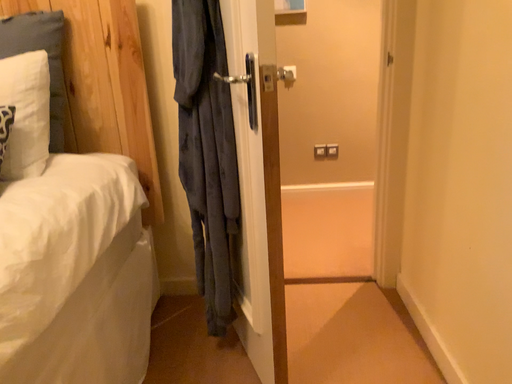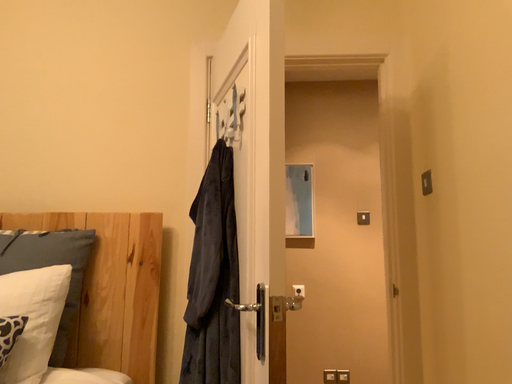
Question: Which way did the camera rotate in the video?

Choices:
 (A) rotated downward
 (B) rotated upward

Answer: (B)